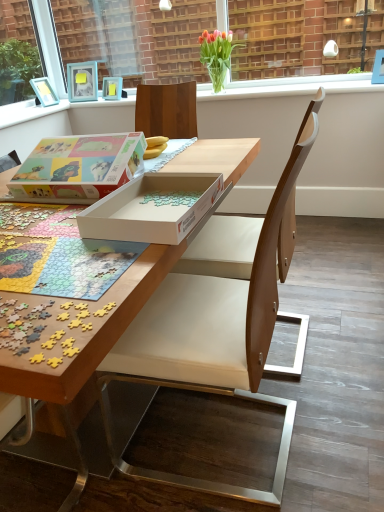
Question: Are wooden chair at center and white cardboard box at center located far from each other?

Choices:
 (A) yes
 (B) no

Answer: (B)

Question: Is wooden chair at center facing towards white cardboard box at center?

Choices:
 (A) no
 (B) yes

Answer: (B)

Question: From the image's perspective, is wooden chair at center on top of white cardboard box at center?

Choices:
 (A) no
 (B) yes

Answer: (A)

Question: Can you confirm if wooden chair at center is shorter than white cardboard box at center?

Choices:
 (A) yes
 (B) no

Answer: (B)

Question: Does wooden chair at center lie behind white cardboard box at center?

Choices:
 (A) yes
 (B) no

Answer: (B)

Question: Is wooden chair at center not inside white cardboard box at center?

Choices:
 (A) no
 (B) yes

Answer: (B)

Question: Can you confirm if clear glass window frame at upper center is thinner than vivid tulips in glass vase at upper center?

Choices:
 (A) no
 (B) yes

Answer: (B)

Question: From a real-world perspective, is clear glass window frame at upper center physically above vivid tulips in glass vase at upper center?

Choices:
 (A) yes
 (B) no

Answer: (A)

Question: Is clear glass window frame at upper center facing towards vivid tulips in glass vase at upper center?

Choices:
 (A) no
 (B) yes

Answer: (B)

Question: Is clear glass window frame at upper center touching vivid tulips in glass vase at upper center?

Choices:
 (A) no
 (B) yes

Answer: (A)

Question: Does clear glass window frame at upper center lie behind vivid tulips in glass vase at upper center?

Choices:
 (A) yes
 (B) no

Answer: (B)

Question: Is clear glass window frame at upper center not close to vivid tulips in glass vase at upper center?

Choices:
 (A) yes
 (B) no

Answer: (A)

Question: Is clear glass window frame at upper center behind pastel matte puzzle box at center?

Choices:
 (A) yes
 (B) no

Answer: (A)